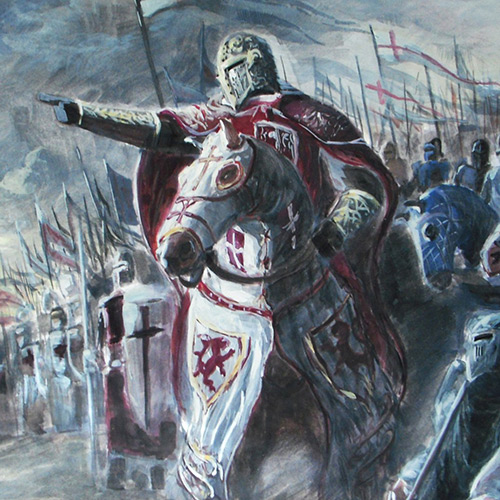
The height and width of the screenshot is (500, 500). Find the location of `upper left corner of artwork`. upper left corner of artwork is located at coordinates (2, 0).